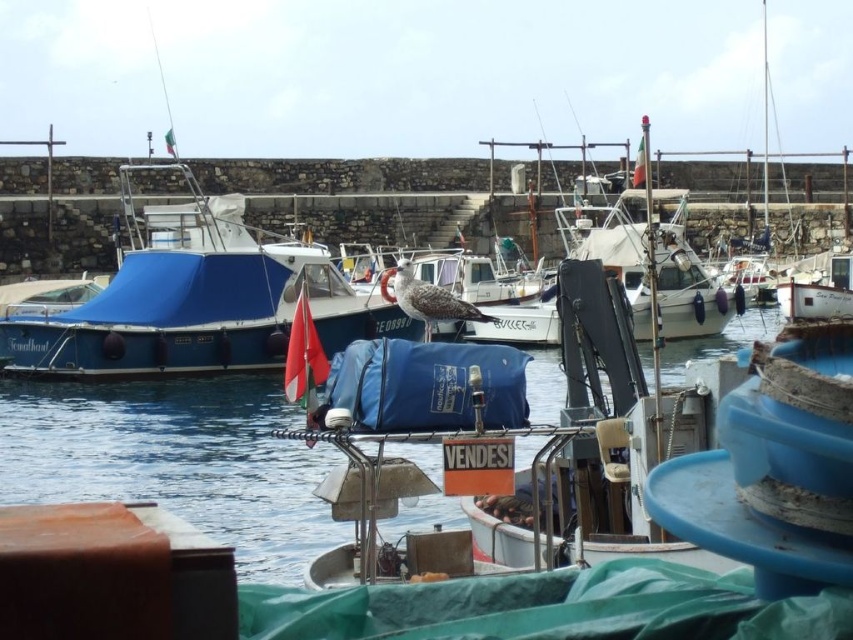
Describe the element at coordinates (195, 298) in the screenshot. I see `blue tarpaulin boat at left` at that location.

Can you confirm if blue tarpaulin boat at left is thinner than gray feathered seagull at center?

Incorrect, blue tarpaulin boat at left's width is not less than gray feathered seagull at center's.

Between point (148, 237) and point (450, 296), which one is positioned in front?

Point (450, 296)

Locate an element on the screen. This screenshot has width=853, height=640. blue tarpaulin boat at left is located at coordinates (195, 298).

Who is lower down, blue water at center or gray feathered seagull at center?

blue water at center

Find the location of `blue water at center`. blue water at center is located at coordinates (177, 460).

Identify the location of blue water at center. This screenshot has height=640, width=853. (177, 460).

This screenshot has width=853, height=640. What do you see at coordinates (177, 460) in the screenshot? I see `blue water at center` at bounding box center [177, 460].

The image size is (853, 640). I want to click on blue water at center, so click(177, 460).